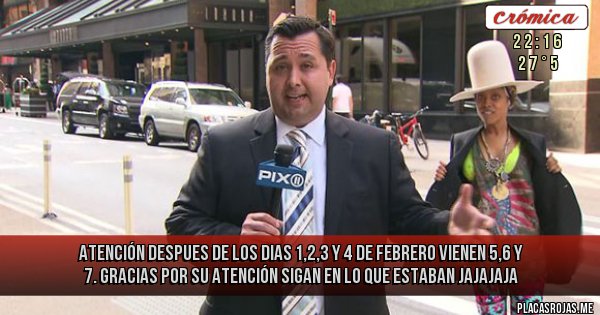
The width and height of the screenshot is (600, 315). In order to click on windows in this screenshot , I will do `click(428, 81)`, `click(408, 79)`, `click(381, 77)`.